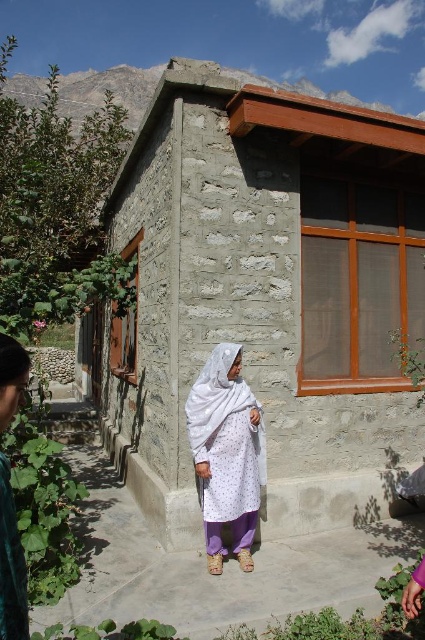
You are standing at the entrance of the stone textured hut at center. If you walk straight ahead, will you immediately encounter an obstacle?

The stone textured hut at center is located at point (263, 294), but without additional information about the surrounding obstacles or pathways, it is impossible to determine if walking straight ahead would lead to an obstacle.